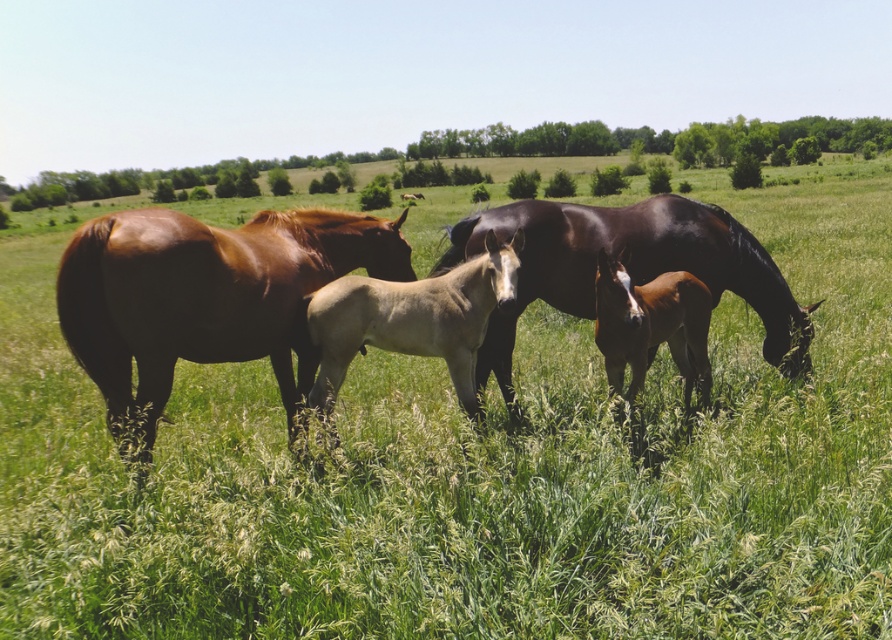
Question: Which of the following is the closest to the observer?

Choices:
 (A) (672, 202)
 (B) (672, 337)
 (C) (108, 426)

Answer: (C)

Question: Which point is closer to the camera?

Choices:
 (A) (715, 244)
 (B) (632, 328)

Answer: (B)

Question: Estimate the real-world distances between objects in this image. Which object is closer to the light tan smooth foal at center?

Choices:
 (A) brown glossy foal at center
 (B) glossy dark brown horse at center
 (C) shiny brown horse at center

Answer: (C)

Question: Is light tan smooth foal at center wider than brown glossy foal at center?

Choices:
 (A) yes
 (B) no

Answer: (A)

Question: Is glossy dark brown horse at center to the left of brown glossy foal at center from the viewer's perspective?

Choices:
 (A) no
 (B) yes

Answer: (A)

Question: Does shiny brown horse at center have a smaller size compared to glossy dark brown horse at center?

Choices:
 (A) yes
 (B) no

Answer: (A)